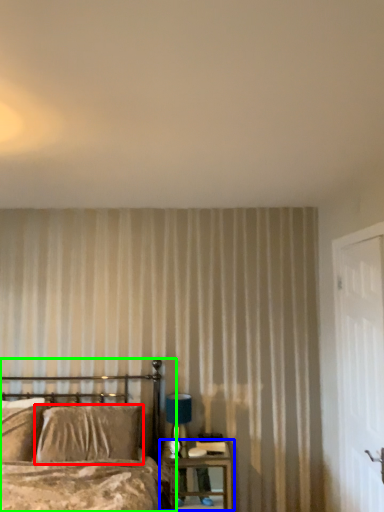
Question: Which is nearer to the pillow (highlighted by a red box)? nightstand (highlighted by a blue box) or bed (highlighted by a green box).

Choices:
 (A) nightstand
 (B) bed

Answer: (B)